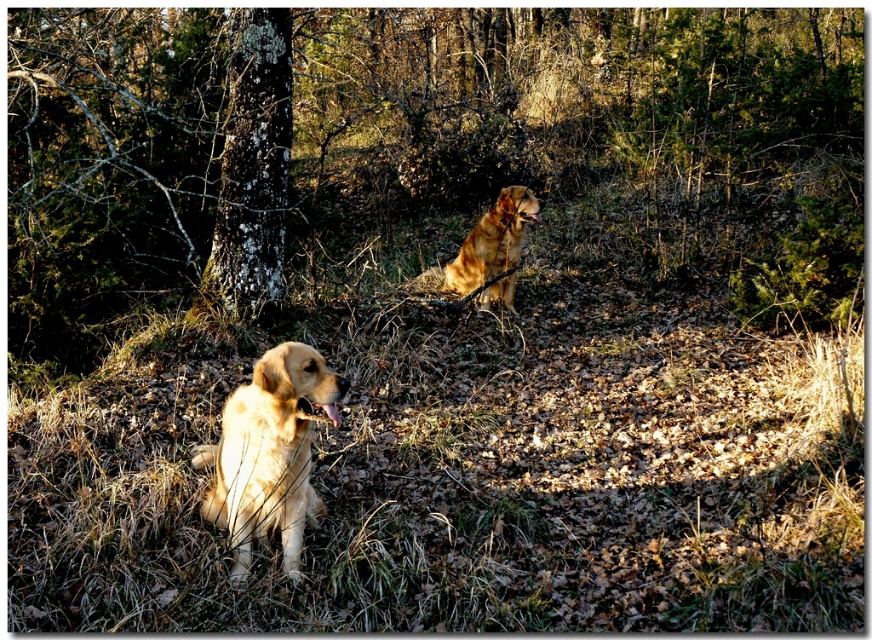
Question: Can you confirm if smooth bark tree at center is smaller than golden fur dog at lower left?

Choices:
 (A) yes
 (B) no

Answer: (A)

Question: Estimate the real-world distances between objects in this image. Which object is farther from the smooth bark tree at center?

Choices:
 (A) golden fur dog at center
 (B) golden fur dog at lower left

Answer: (B)

Question: Is golden fur dog at lower left smaller than golden fur dog at center?

Choices:
 (A) no
 (B) yes

Answer: (B)

Question: Is the position of smooth bark tree at center more distant than that of golden fur dog at lower left?

Choices:
 (A) no
 (B) yes

Answer: (B)

Question: Which object is farther from the camera taking this photo?

Choices:
 (A) golden fur dog at center
 (B) smooth bark tree at center

Answer: (A)

Question: Among these points, which one is farthest from the camera?

Choices:
 (A) (266, 301)
 (B) (487, 216)
 (C) (304, 458)

Answer: (B)